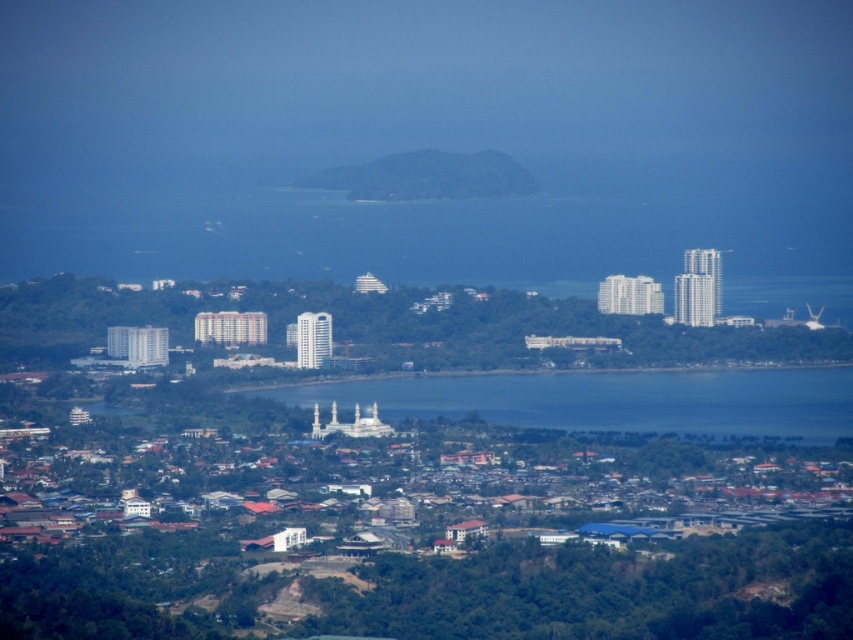
Question: Which of the following is the closest to the observer?

Choices:
 (A) green textured hill at center
 (B) blue water at center

Answer: (B)

Question: Which object is farther from the camera taking this photo?

Choices:
 (A) green textured hill at center
 (B) blue water at center

Answer: (A)

Question: Is blue water at center to the left of green textured hill at center from the viewer's perspective?

Choices:
 (A) yes
 (B) no

Answer: (B)

Question: Does blue water at center come in front of green textured hill at center?

Choices:
 (A) yes
 (B) no

Answer: (A)

Question: Is blue water at center positioned before green textured hill at center?

Choices:
 (A) yes
 (B) no

Answer: (A)